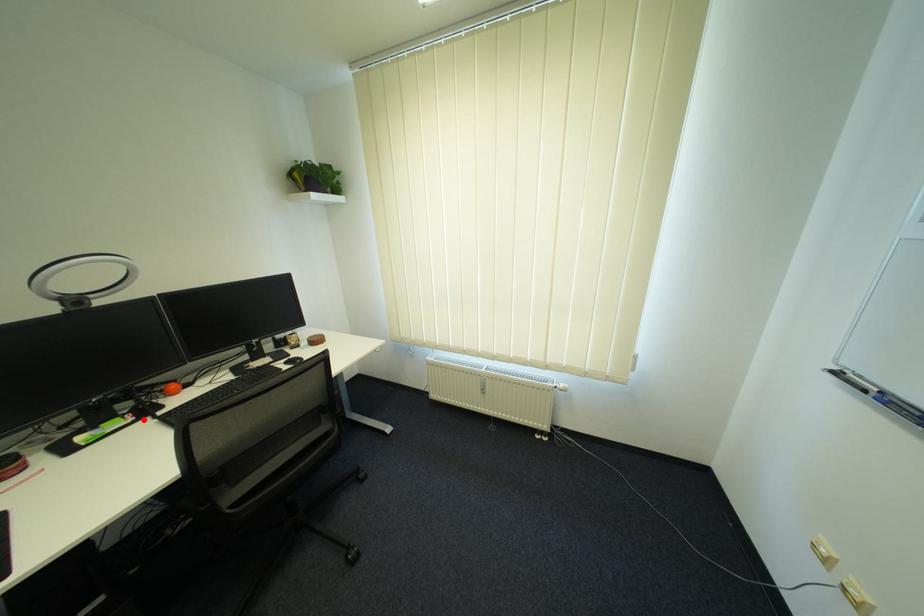
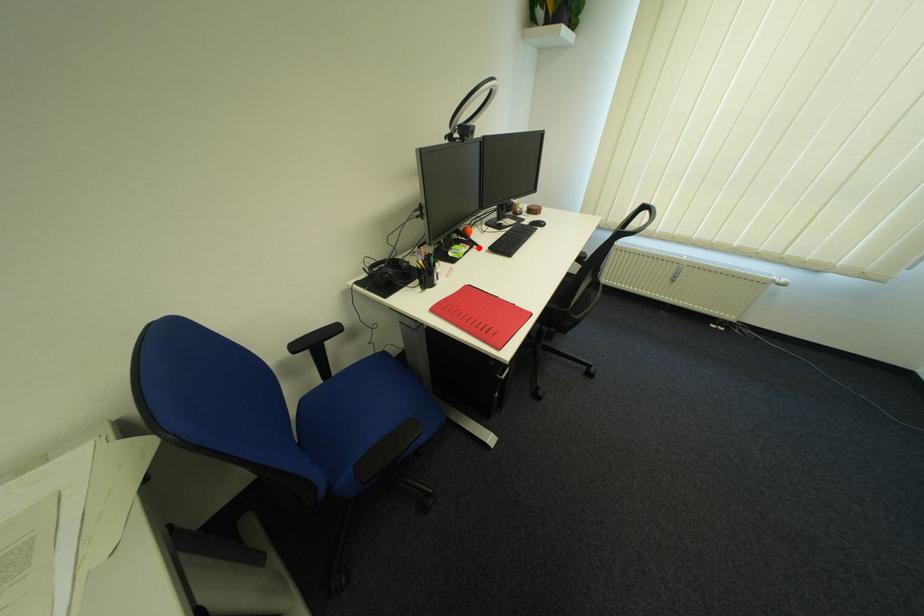
I am providing you with two images of the same scene from different viewpoints. A red point is marked on the first image and another point is marked on the second image. Is the red point in image1 aligned with the point shown in image2?

Yes